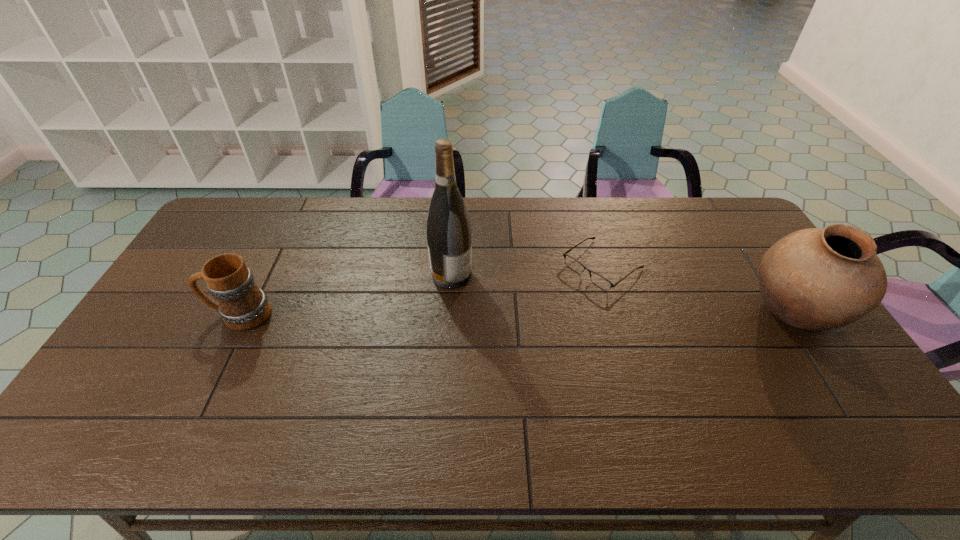
I want to click on vacant space that satisfies the following two spatial constraints: 1. on the back side of the second object from right to left; 2. on the right side of the wine bottle, so click(452, 266).